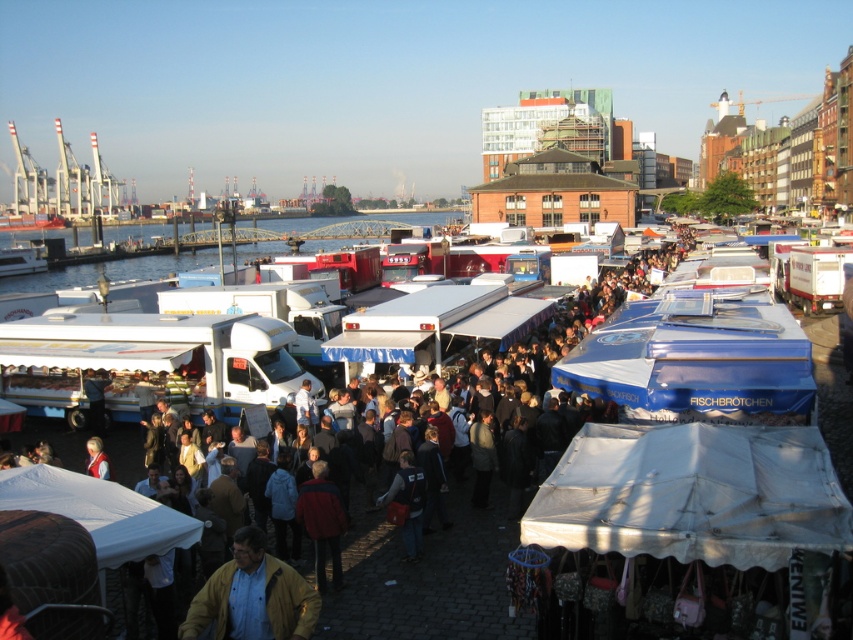
You are a photographer standing at the center of the market, and you want to capture both the red jacket at center and the red wool sweater at lower left in a single photo. Given that your camera has a 50mm lens with a field of view that can capture objects up to 10 meters apart, will you be able to include both items in your shot?

The red jacket at center and red wool sweater at lower left are 13.78 meters apart from each other, which exceeds the camera lens field of view of 10 meters. Therefore, you cannot include both items in a single photo with the current lens.

You are a photographer trying to capture a candid shot of the crowd at the bustling outdoor market. You notice a person wearing a red jacket at center and another carrying a matte black backpack at center. Since you want to ensure both subjects are in frame, which object should you adjust your camera angle to focus on first to account for their size difference?

The red jacket at center has a larger width than the matte black backpack at center, so you should focus on the red jacket at center first to ensure it fits within the frame before adjusting for the smaller backpack.